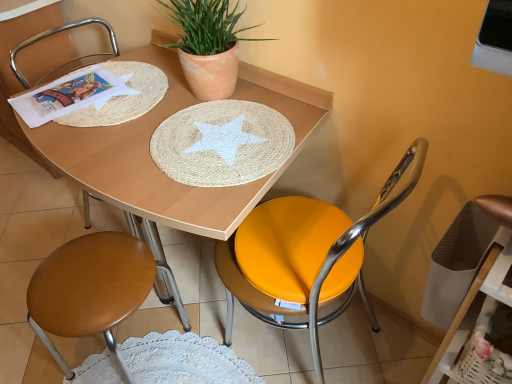
Where is `free space above matte wood table at center (from a real-world perspective)`? The height and width of the screenshot is (384, 512). free space above matte wood table at center (from a real-world perspective) is located at coordinates (116, 106).